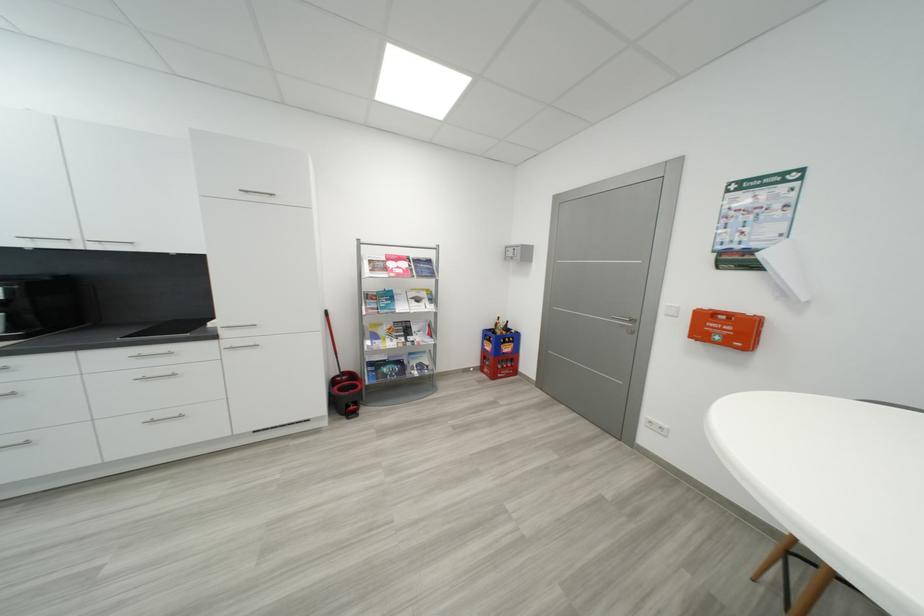
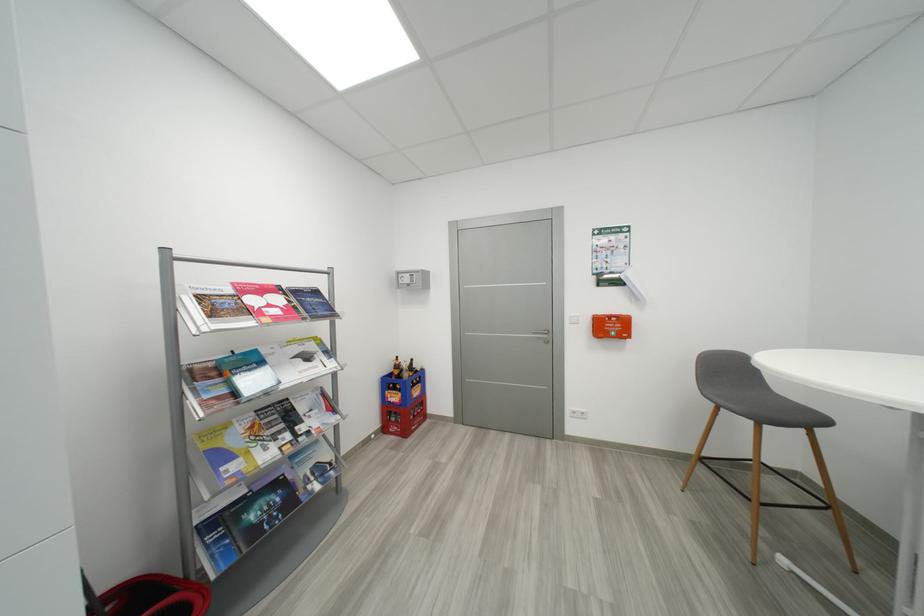
Find the pixel in the second image that matches pixel 517 254 in the first image.

(412, 282)